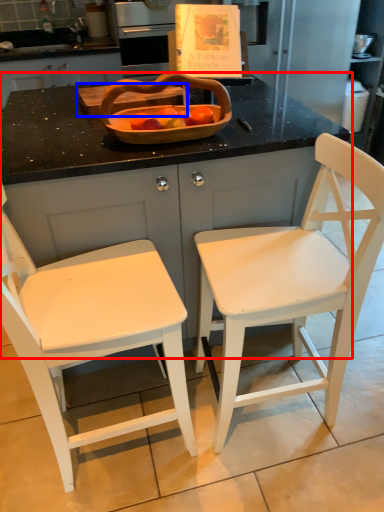
Question: Among these objects, which one is nearest to the camera, counter (highlighted by a red box) or cutting board (highlighted by a blue box)?

Choices:
 (A) counter
 (B) cutting board

Answer: (A)